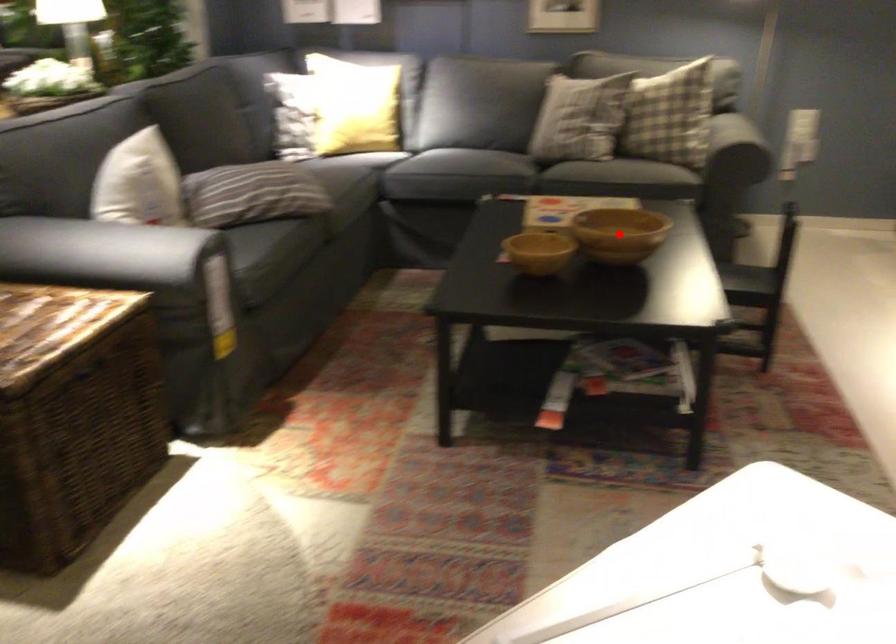
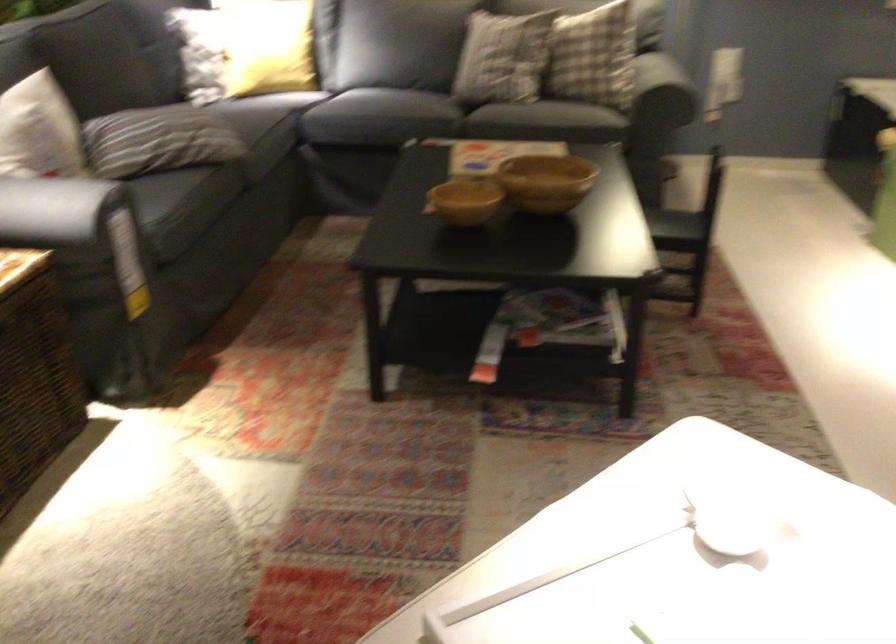
Question: I am providing you with two images of the same scene from different viewpoints. A red point is marked on the first image. Can you still see the location of the red point in image 2?

Choices:
 (A) Yes
 (B) No

Answer: (B)